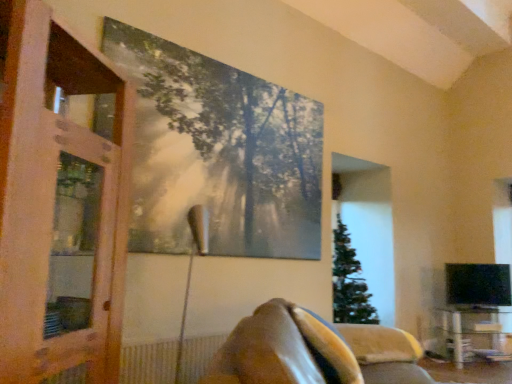
Question: In terms of height, does wooden screen door at left look taller or shorter compared to velvety brown pillow at lower center?

Choices:
 (A) short
 (B) tall

Answer: (B)

Question: From a real-world perspective, is wooden screen door at left physically located above or below velvety brown pillow at lower center?

Choices:
 (A) above
 (B) below

Answer: (A)

Question: Estimate the real-world distances between objects in this image. Which object is farther from the brown leather couch at lower center?

Choices:
 (A) wooden screen door at left
 (B) clear glass table at lower right
 (C) velvety brown pillow at lower center
 (D) metallic silver tree at upper center

Answer: (B)

Question: Which of these objects is positioned closest to the velvety brown pillow at lower center?

Choices:
 (A) metallic silver tree at upper center
 (B) clear glass table at lower right
 (C) brown leather couch at lower center
 (D) wooden screen door at left

Answer: (C)